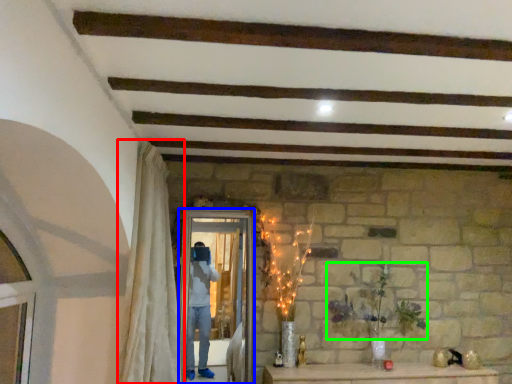
Question: Considering the real-world distances, which object is farthest from curtain (highlighted by a red box)? screen door (highlighted by a blue box) or plant (highlighted by a green box)?

Choices:
 (A) screen door
 (B) plant

Answer: (B)